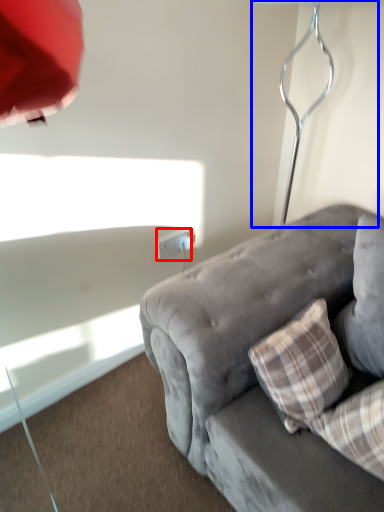
Question: Which point is further to the camera, power outlet (highlighted by a red box) or table lamp (highlighted by a blue box)?

Choices:
 (A) power outlet
 (B) table lamp

Answer: (A)